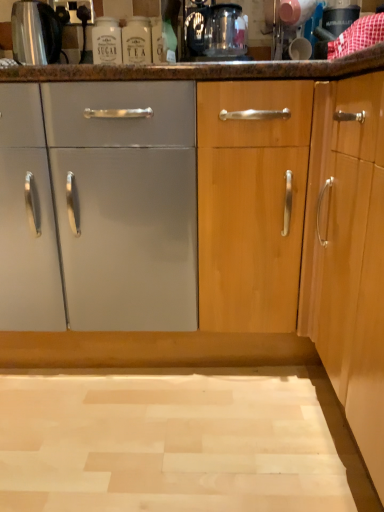
Question: Does brushed metal kettle at upper left come in front of white glass bottle at upper center?

Choices:
 (A) yes
 (B) no

Answer: (A)

Question: From the image's perspective, does brushed metal kettle at upper left appear higher than white glass bottle at upper center?

Choices:
 (A) yes
 (B) no

Answer: (A)

Question: Is brushed metal kettle at upper left aimed at white glass bottle at upper center?

Choices:
 (A) yes
 (B) no

Answer: (B)

Question: Is brushed metal kettle at upper left wider than white glass bottle at upper center?

Choices:
 (A) yes
 (B) no

Answer: (A)

Question: Is white glass bottle at upper center completely or partially inside brushed metal kettle at upper left?

Choices:
 (A) no
 (B) yes

Answer: (A)

Question: Is transparent glass coffee machine at upper center bigger or smaller than brushed metal kettle at upper left?

Choices:
 (A) big
 (B) small

Answer: (A)

Question: Would you say transparent glass coffee machine at upper center is inside or outside brushed metal kettle at upper left?

Choices:
 (A) outside
 (B) inside

Answer: (A)

Question: Is transparent glass coffee machine at upper center to the left or to the right of brushed metal kettle at upper left in the image?

Choices:
 (A) right
 (B) left

Answer: (A)

Question: Considering the positions of point (213, 16) and point (26, 14), is point (213, 16) closer or farther from the camera than point (26, 14)?

Choices:
 (A) farther
 (B) closer

Answer: (B)

Question: Visually, is white glass bottle at upper center positioned to the left or to the right of transparent glass coffee machine at upper center?

Choices:
 (A) left
 (B) right

Answer: (A)

Question: Considering the positions of white glass bottle at upper center and transparent glass coffee machine at upper center in the image, is white glass bottle at upper center taller or shorter than transparent glass coffee machine at upper center?

Choices:
 (A) tall
 (B) short

Answer: (A)

Question: In terms of width, does white glass bottle at upper center look wider or thinner when compared to transparent glass coffee machine at upper center?

Choices:
 (A) thin
 (B) wide

Answer: (A)

Question: In terms of size, does white glass bottle at upper center appear bigger or smaller than transparent glass coffee machine at upper center?

Choices:
 (A) small
 (B) big

Answer: (A)

Question: From the image's perspective, is transparent glass coffee machine at upper center above or below white glass bottle at upper center?

Choices:
 (A) below
 (B) above

Answer: (A)

Question: Considering the positions of transparent glass coffee machine at upper center and white glass bottle at upper center in the image, is transparent glass coffee machine at upper center bigger or smaller than white glass bottle at upper center?

Choices:
 (A) small
 (B) big

Answer: (B)